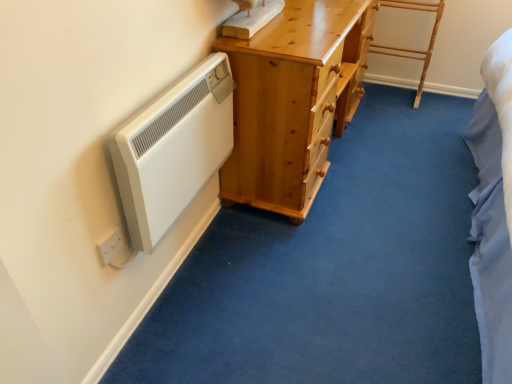
The width and height of the screenshot is (512, 384). Describe the element at coordinates (292, 101) in the screenshot. I see `light brown wooden chest of drawers at center` at that location.

The image size is (512, 384). Find the location of `light brown wooden chest of drawers at center`. light brown wooden chest of drawers at center is located at coordinates point(292,101).

This screenshot has height=384, width=512. I want to click on white matte radiator at left, so click(172, 149).

Locate an element on the screen. The width and height of the screenshot is (512, 384). light wood/rough textured ladder at upper right is located at coordinates (408, 48).

This screenshot has height=384, width=512. What do you see at coordinates (408, 48) in the screenshot?
I see `light wood/rough textured ladder at upper right` at bounding box center [408, 48].

Where is `light brown wooden chest of drawers at center`? light brown wooden chest of drawers at center is located at coordinates (292, 101).

How many degrees apart are the facing directions of white plastic electric outlet at lower left and light wood/rough textured ladder at upper right?

91.4 degrees separate the facing orientations of white plastic electric outlet at lower left and light wood/rough textured ladder at upper right.

Which is closer to the camera, (x=108, y=243) or (x=436, y=3)?

Point (x=108, y=243) is positioned closer to the camera compared to point (x=436, y=3).

Is white plastic electric outlet at lower left in front of or behind light wood/rough textured ladder at upper right in the image?

white plastic electric outlet at lower left is positioned closer to the viewer than light wood/rough textured ladder at upper right.

Is white plastic electric outlet at lower left not within light wood/rough textured ladder at upper right?

white plastic electric outlet at lower left lies outside light wood/rough textured ladder at upper right's area.

Is point (109, 241) closer or farther from the camera than point (306, 11)?

Point (109, 241) is closer to the camera than point (306, 11).

How distant is white plastic electric outlet at lower left from light brown wooden chest of drawers at center?

white plastic electric outlet at lower left is 36.85 inches away from light brown wooden chest of drawers at center.

Which of these two, white plastic electric outlet at lower left or light brown wooden chest of drawers at center, is wider?

Wider between the two is light brown wooden chest of drawers at center.

What's the angular difference between white plastic electric outlet at lower left and light brown wooden chest of drawers at center's facing directions?

The angular difference between white plastic electric outlet at lower left and light brown wooden chest of drawers at center is 1.36 degrees.

The height and width of the screenshot is (384, 512). In order to click on furniture below the white plastic electric outlet at lower left (from a real-world perspective) in this screenshot , I will do `click(408, 48)`.

Is point (434, 35) more distant than point (105, 243)?

Yes, it is behind point (105, 243).

In the scene shown: Is light wood/rough textured ladder at upper right bigger than white plastic electric outlet at lower left?

Yes, light wood/rough textured ladder at upper right is bigger than white plastic electric outlet at lower left.

Is light wood/rough textured ladder at upper right touching white plastic electric outlet at lower left?

There is a gap between light wood/rough textured ladder at upper right and white plastic electric outlet at lower left.

I want to click on appliance that appears in front of the white plastic electric outlet at lower left, so click(x=172, y=149).

Are white plastic electric outlet at lower left and white matte radiator at left far apart?

No.

From the image's perspective, is white plastic electric outlet at lower left positioned above or below white matte radiator at left?

Clearly, from the image's perspective, white plastic electric outlet at lower left is below white matte radiator at left.

From a real-world perspective, is white plastic electric outlet at lower left over white matte radiator at left?

No, from a real-world perspective, white plastic electric outlet at lower left is not over white matte radiator at left

Can we say light wood/rough textured ladder at upper right lies outside light brown wooden chest of drawers at center?

Yes, light wood/rough textured ladder at upper right is located beyond the bounds of light brown wooden chest of drawers at center.

Can you see light wood/rough textured ladder at upper right touching light brown wooden chest of drawers at center?

light wood/rough textured ladder at upper right and light brown wooden chest of drawers at center are clearly separated.

Which object is wider, light wood/rough textured ladder at upper right or light brown wooden chest of drawers at center?

light brown wooden chest of drawers at center.

From the image's perspective, which is below, white matte radiator at left or light wood/rough textured ladder at upper right?

white matte radiator at left is shown below in the image.

From the picture: Considering the sizes of objects white matte radiator at left and light wood/rough textured ladder at upper right in the image provided, who is bigger, white matte radiator at left or light wood/rough textured ladder at upper right?

Bigger between the two is light wood/rough textured ladder at upper right.

Between white matte radiator at left and light wood/rough textured ladder at upper right, which one has larger width?

With larger width is light wood/rough textured ladder at upper right.

Find the location of `appliance in front of the light wood/rough textured ladder at upper right`. appliance in front of the light wood/rough textured ladder at upper right is located at coordinates click(x=172, y=149).

Does white matte radiator at left come behind white plastic electric outlet at lower left?

→ No, white matte radiator at left is in front of white plastic electric outlet at lower left.

In the scene shown: Is white matte radiator at left positioned far away from white plastic electric outlet at lower left?

No.

Does white matte radiator at left appear on the right side of white plastic electric outlet at lower left?

Correct, you'll find white matte radiator at left to the right of white plastic electric outlet at lower left.

Does point (220, 104) come farther from viewer compared to point (108, 248)?

That is True.

The width and height of the screenshot is (512, 384). There is a light wood/rough textured ladder at upper right. In order to click on electric outlet above it (from a real-world perspective) in this screenshot , I will do `click(110, 247)`.

The height and width of the screenshot is (384, 512). I want to click on electric outlet on the left of light brown wooden chest of drawers at center, so click(110, 247).

Based on their spatial positions, is white plastic electric outlet at lower left or white matte radiator at left further from light brown wooden chest of drawers at center?

Based on the image, white plastic electric outlet at lower left appears to be further to light brown wooden chest of drawers at center.

Looking at the image, which one is located further to white plastic electric outlet at lower left, light wood/rough textured ladder at upper right or light brown wooden chest of drawers at center?

Based on the image, light wood/rough textured ladder at upper right appears to be further to white plastic electric outlet at lower left.

From the image, which object appears to be nearer to white plastic electric outlet at lower left, white matte radiator at left or light brown wooden chest of drawers at center?

white matte radiator at left lies closer to white plastic electric outlet at lower left than the other object.

Considering their positions, is light wood/rough textured ladder at upper right positioned closer to light brown wooden chest of drawers at center than white matte radiator at left?

white matte radiator at left lies closer to light brown wooden chest of drawers at center than the other object.

Which object lies further to the anchor point light wood/rough textured ladder at upper right, white matte radiator at left or light brown wooden chest of drawers at center?

Based on the image, white matte radiator at left appears to be further to light wood/rough textured ladder at upper right.

Estimate the real-world distances between objects in this image. Which object is closer to light brown wooden chest of drawers at center, white plastic electric outlet at lower left or light wood/rough textured ladder at upper right?

white plastic electric outlet at lower left is closer to light brown wooden chest of drawers at center.

Considering their positions, is light wood/rough textured ladder at upper right positioned further to white matte radiator at left than white plastic electric outlet at lower left?

The object further to white matte radiator at left is light wood/rough textured ladder at upper right.

Based on their spatial positions, is white matte radiator at left or light wood/rough textured ladder at upper right further from light brown wooden chest of drawers at center?

light wood/rough textured ladder at upper right is positioned further to the anchor light brown wooden chest of drawers at center.

In order to click on chest of drawers between white plastic electric outlet at lower left and light wood/rough textured ladder at upper right in this screenshot , I will do `click(292, 101)`.

This screenshot has width=512, height=384. What are the coordinates of `appliance between light brown wooden chest of drawers at center and white plastic electric outlet at lower left from top to bottom` in the screenshot? It's located at (172, 149).

I want to click on the chest of drawers positioned between white matte radiator at left and light wood/rough textured ladder at upper right from near to far, so click(x=292, y=101).

The image size is (512, 384). I want to click on electric outlet located between white matte radiator at left and light wood/rough textured ladder at upper right in the depth direction, so click(x=110, y=247).